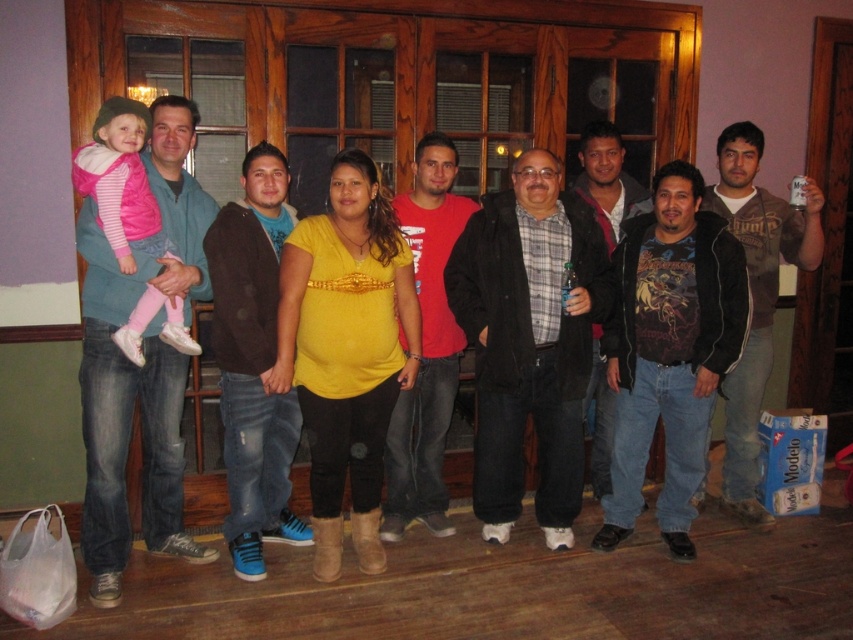
Question: Which point is closer to the camera?

Choices:
 (A) (122, 164)
 (B) (618, 230)

Answer: (A)

Question: Which of these objects is positioned farthest from the matte blue jeans at center?

Choices:
 (A) dark blue jeans at center
 (B) denim jacket at left
 (C) yellow matte shirt at center

Answer: (A)

Question: Which object appears closest to the camera in this image?

Choices:
 (A) plaid fabric shirt at center
 (B) dark gray jacket at center

Answer: (A)

Question: Where is matte blue jeans at center located in relation to dark gray jacket at center in the image?

Choices:
 (A) right
 (B) left

Answer: (B)

Question: Can you confirm if dark brown leather jacket at right is bigger than pink fleece jacket at left?

Choices:
 (A) yes
 (B) no

Answer: (A)

Question: Is plaid fabric shirt at center above denim jeans at center?

Choices:
 (A) yes
 (B) no

Answer: (B)